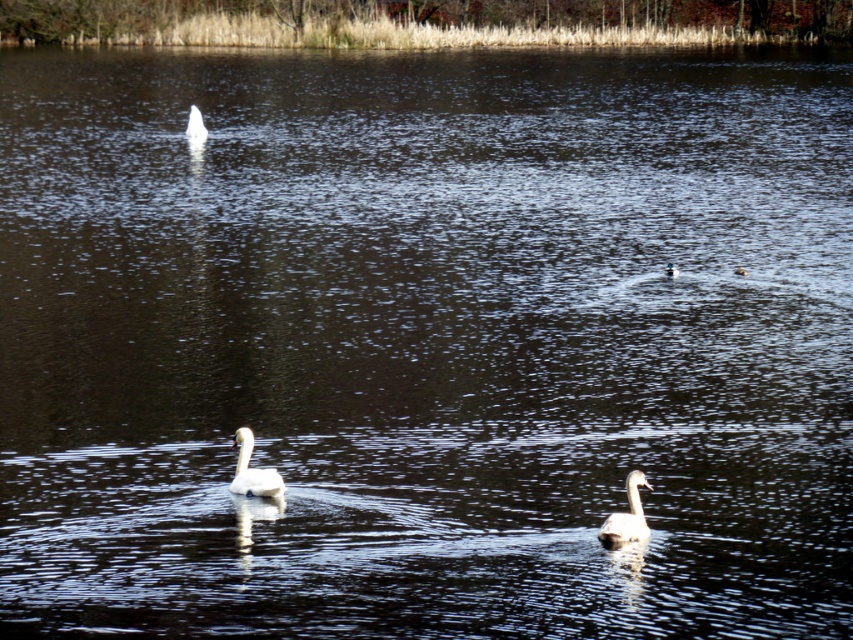
Question: Which point is closer to the camera?

Choices:
 (A) (247, 456)
 (B) (631, 474)

Answer: (B)

Question: Which point is closer to the camera?

Choices:
 (A) (602, 528)
 (B) (265, 492)
 (C) (190, 124)

Answer: (A)

Question: Is white matte swan at center above brown fuzzy duck at upper right?

Choices:
 (A) yes
 (B) no

Answer: (B)

Question: Which point appears farthest from the camera in this image?

Choices:
 (A) (186, 125)
 (B) (618, 534)

Answer: (A)

Question: Does white matte swan at lower right have a smaller size compared to white matte swan at center?

Choices:
 (A) no
 (B) yes

Answer: (B)

Question: Is white matte swan at center wider than white glossy duck at upper center?

Choices:
 (A) no
 (B) yes

Answer: (A)